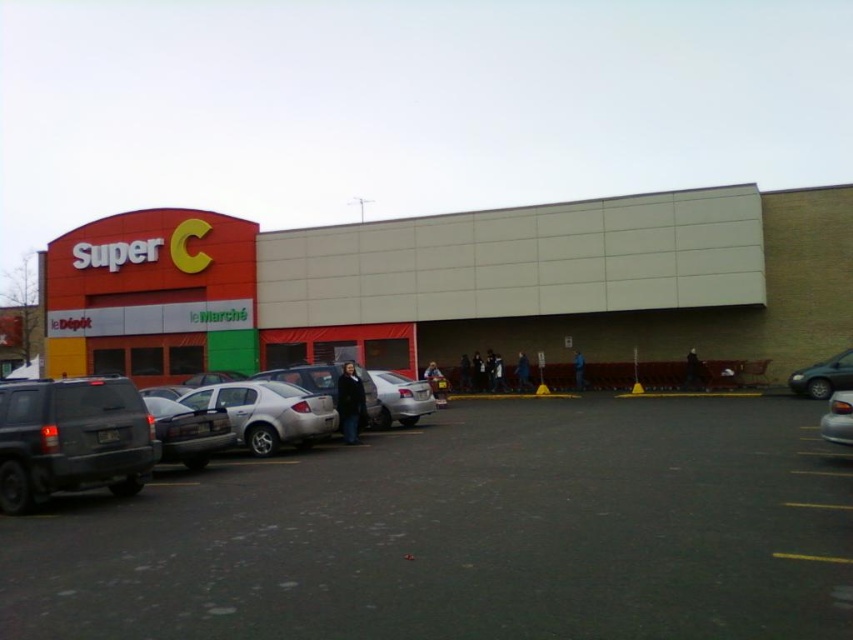
Question: Does matte black suv at lower left appear on the right side of metallic silver sedan at right?

Choices:
 (A) yes
 (B) no

Answer: (B)

Question: Among these points, which one is nearest to the camera?

Choices:
 (A) (329, 410)
 (B) (216, 316)
 (C) (277, 381)

Answer: (A)

Question: Is silver metallic sedan at center-left wider than metallic silver sedan at lower right?

Choices:
 (A) yes
 (B) no

Answer: (B)

Question: Which point is farther to the camera?

Choices:
 (A) dark blue jeans at lower right
 (B) red brick building at center

Answer: (A)

Question: Does dark gray asphalt at lower left have a lesser width compared to metallic silver sedan at right?

Choices:
 (A) yes
 (B) no

Answer: (B)

Question: Estimate the real-world distances between objects in this image. Which object is closer to the metallic silver sedan at lower right?

Choices:
 (A) silver metallic sedan at center
 (B) silver metallic sedan at center-left

Answer: (A)